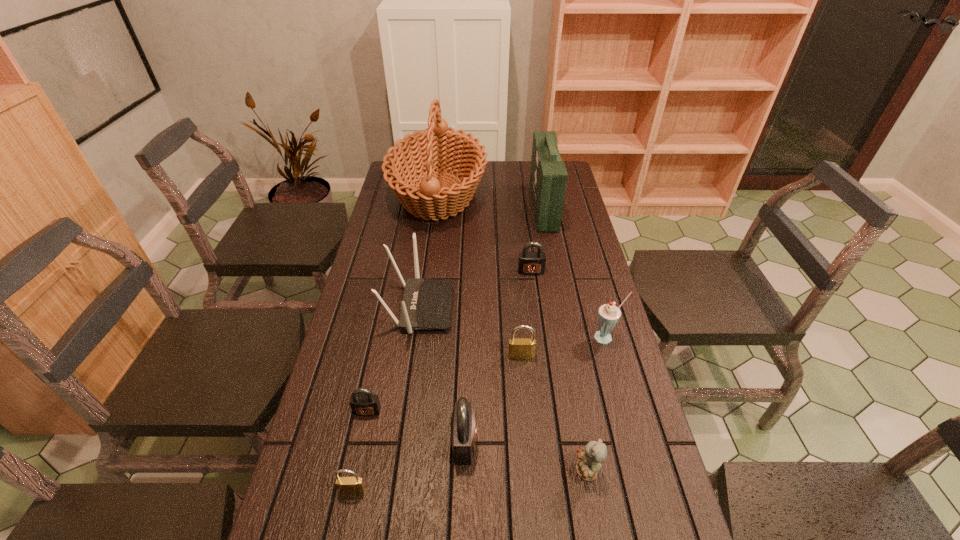
In the image, there is a desktop. Where is `free space at the far edge`? free space at the far edge is located at coordinates (480, 187).

In the image, there is a desktop. Where is `free space at the left edge`? The image size is (960, 540). free space at the left edge is located at coordinates (345, 441).

Where is `vacant region at the right edge of the desktop`? This screenshot has width=960, height=540. vacant region at the right edge of the desktop is located at coordinates (586, 305).

Locate an element on the screen. free space between the rightmost object and the router is located at coordinates (513, 322).

This screenshot has height=540, width=960. I want to click on free space between the milkshake and the router, so click(x=513, y=322).

Identify the location of free space between the first-aid kit and the farther brass padlock. (532, 281).

The height and width of the screenshot is (540, 960). I want to click on vacant point located between the blue teddy bear and the rightmost object, so click(597, 404).

Locate an element on the screen. This screenshot has width=960, height=540. vacant area between the basket and the second biggest gray padlock is located at coordinates (485, 233).

Where is `vacant area that lies between the router and the smaller brass padlock`? The height and width of the screenshot is (540, 960). vacant area that lies between the router and the smaller brass padlock is located at coordinates 386,399.

Identify the location of empty space that is in between the rightmost gray padlock and the smaller brass padlock. (442, 381).